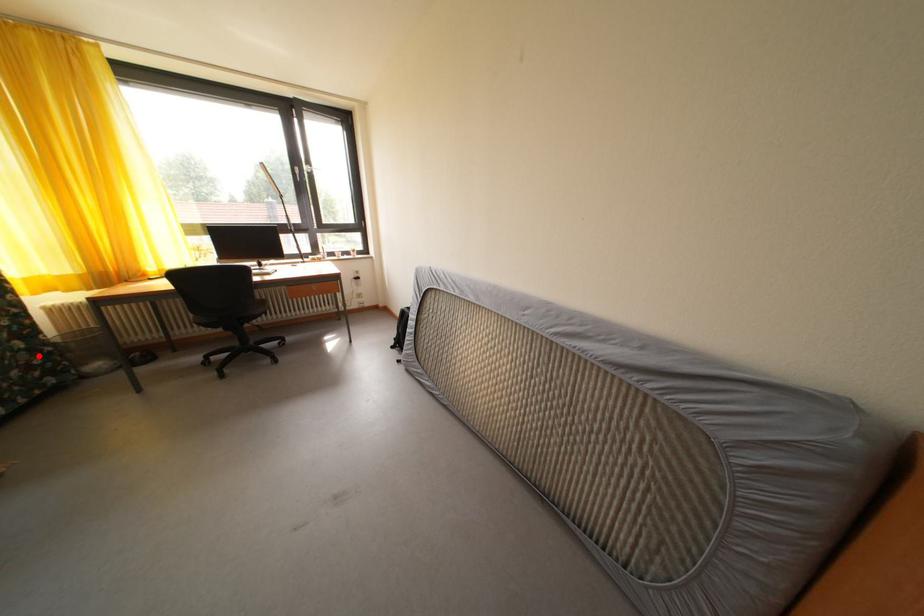
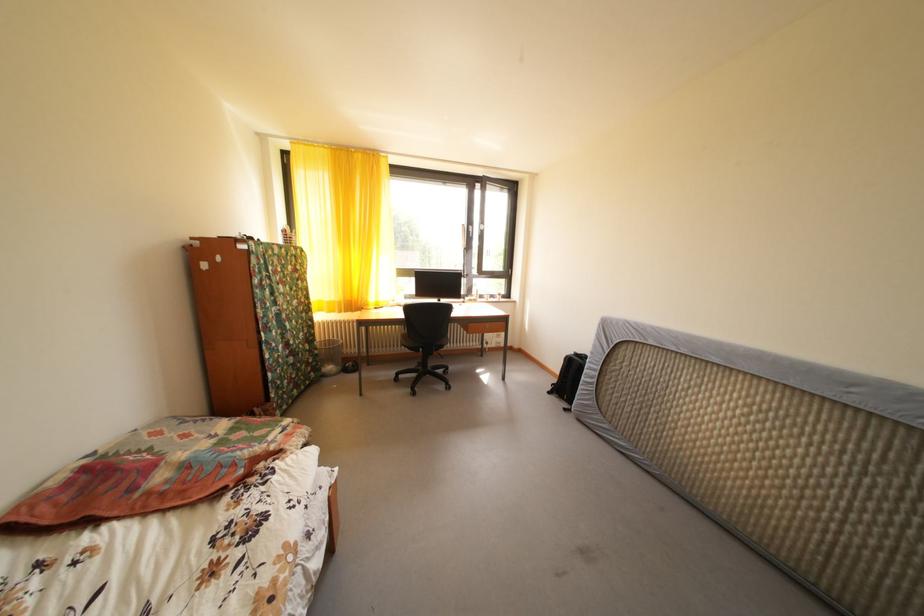
Question: A red point is marked in image1. In image2, is the corresponding 3D point closer to the camera or farther? Reply with the corresponding letter.

Choices:
 (A) The corresponding 3D point is closer.
 (B) The corresponding 3D point is farther.

Answer: (A)